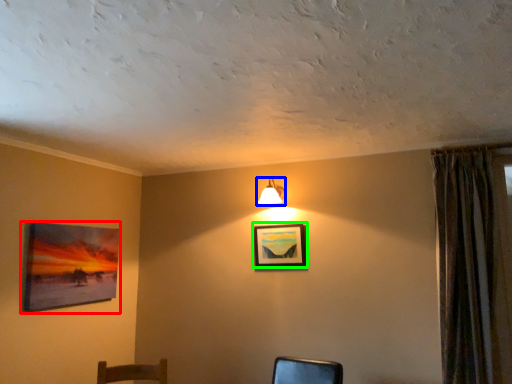
Question: Which is farther away from picture frame (highlighted by a red box)? lamp (highlighted by a blue box) or picture frame (highlighted by a green box)?

Choices:
 (A) lamp
 (B) picture frame

Answer: (A)